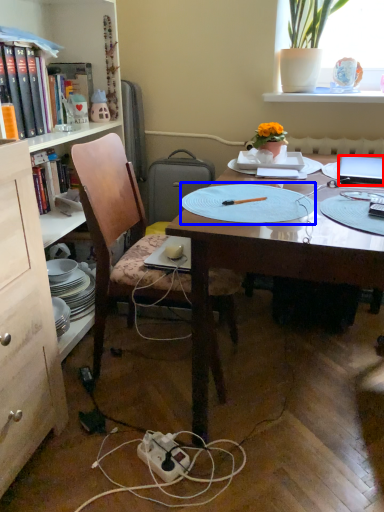
Question: Which object is closer to the camera taking this photo, laptop (highlighted by a red box) or paper plate (highlighted by a blue box)?

Choices:
 (A) laptop
 (B) paper plate

Answer: (B)